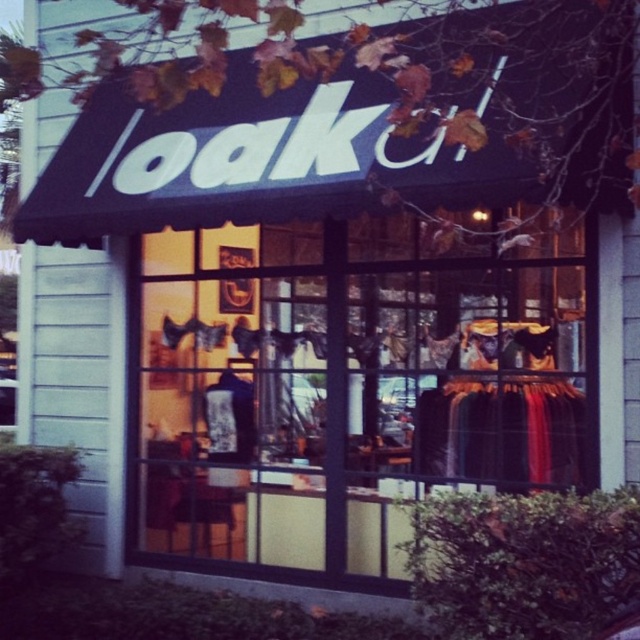
Is transparent glass shop window at center thinner than black fabric dress at center?

In fact, transparent glass shop window at center might be wider than black fabric dress at center.

Who is positioned more to the right, transparent glass shop window at center or black fabric dress at center?

black fabric dress at center is more to the right.

Which is in front, point (397, 480) or point (532, 396)?

Point (532, 396)

The image size is (640, 640). In order to click on transparent glass shop window at center in this screenshot , I will do `click(348, 385)`.